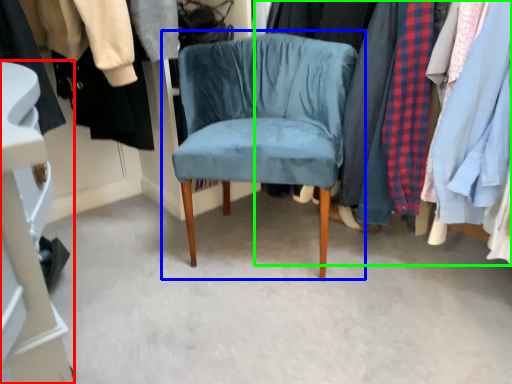
Question: Based on their relative distances, which object is farther from closet (highlighted by a red box)? Choose from chair (highlighted by a blue box) and closet (highlighted by a green box).

Choices:
 (A) chair
 (B) closet

Answer: (B)